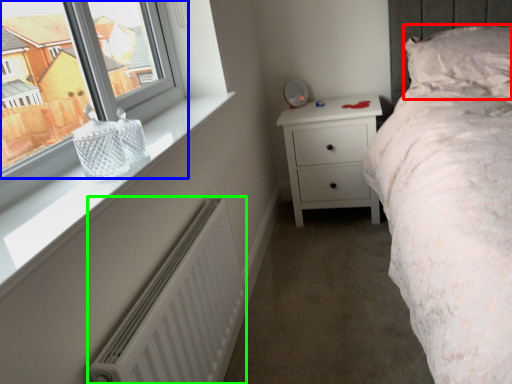
Question: Estimate the real-world distances between objects in this image. Which object is farther from pillow (highlighted by a red box), window (highlighted by a blue box) or radiator (highlighted by a green box)?

Choices:
 (A) window
 (B) radiator

Answer: (A)